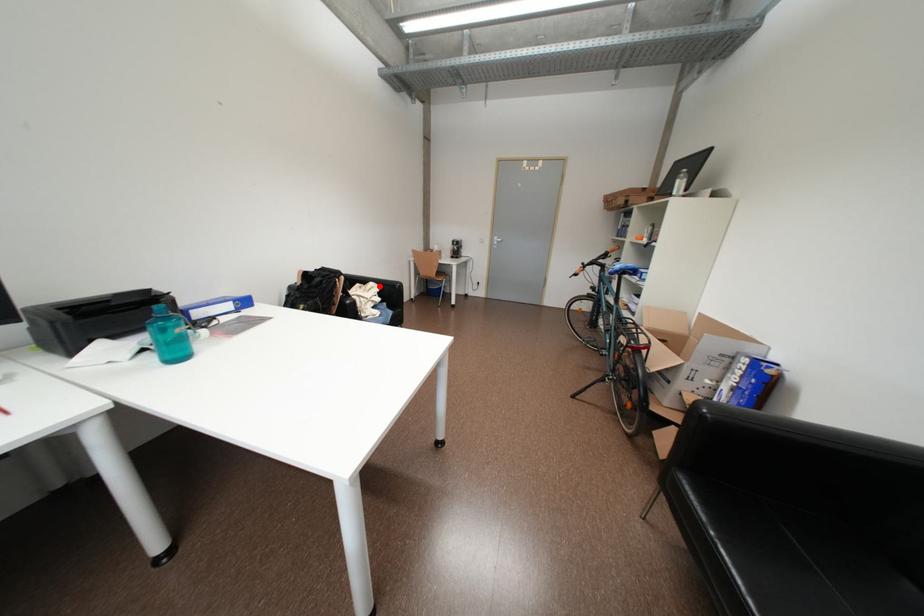
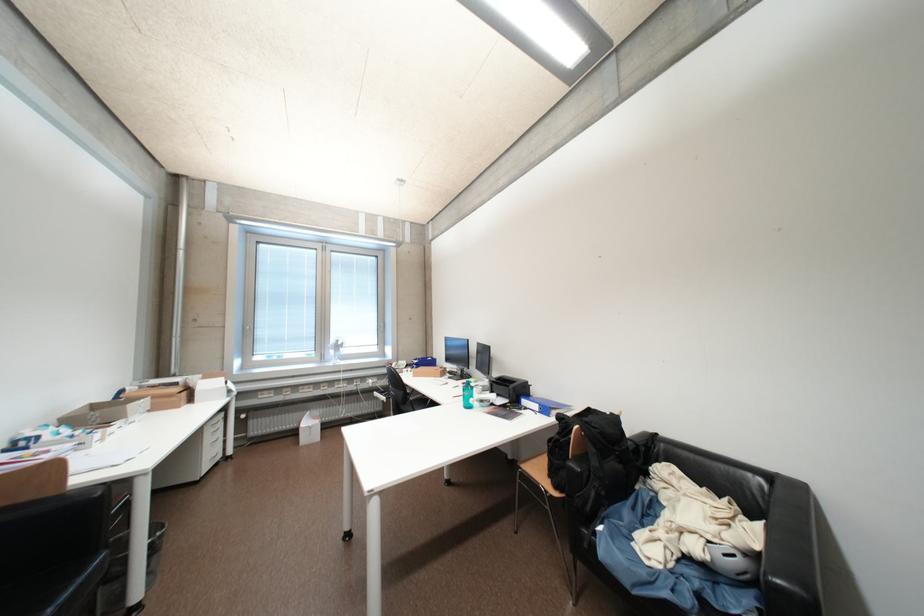
Question: I am providing you with two images of the same scene from different viewpoints. Image1 has a red point marked. In image2, the corresponding 3D location appears at what relative position? Reply with the corresponding letter.

Choices:
 (A) Closer
 (B) Farther

Answer: (A)